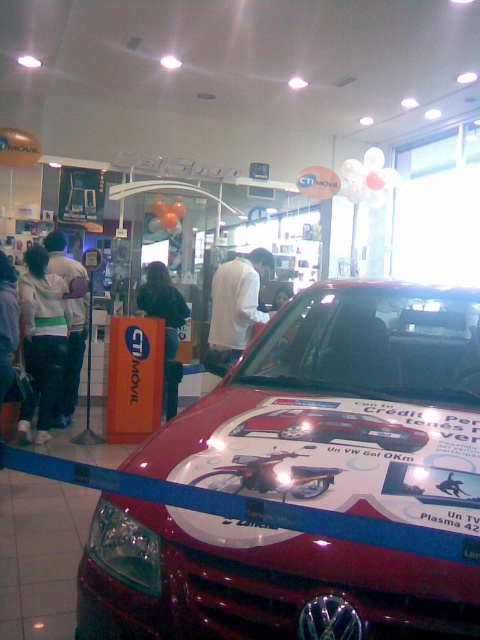
You are a salesperson in the car dealership. You see a customer wearing a white matte shirt at center and a dark fabric jacket at center. The customer wants to know which of their clothes is more likely to show wrinkles. Based on the description, which one would you point out?

The white matte shirt at center is thinner than the dark fabric jacket at center, so the white matte shirt at center is more likely to show wrinkles because thinner fabrics tend to wrinkle more easily.

You are standing in the car dealership and need to find the white fleece jacket at left. According to the scene description, where should you look to find it?

The white fleece jacket at left is located at point (41, 340), so you should look towards the lower left area of the scene.